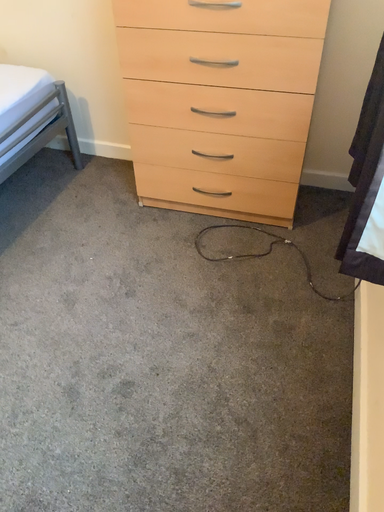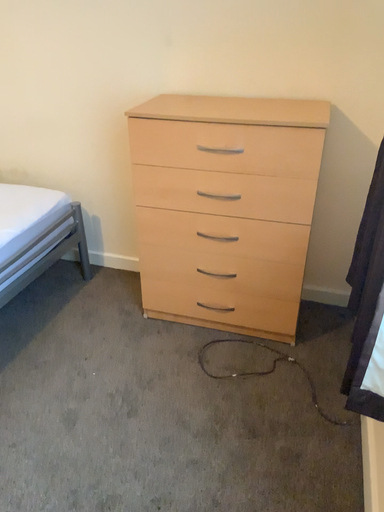
Question: How did the camera likely rotate when shooting the video?

Choices:
 (A) rotated upward
 (B) rotated downward

Answer: (A)